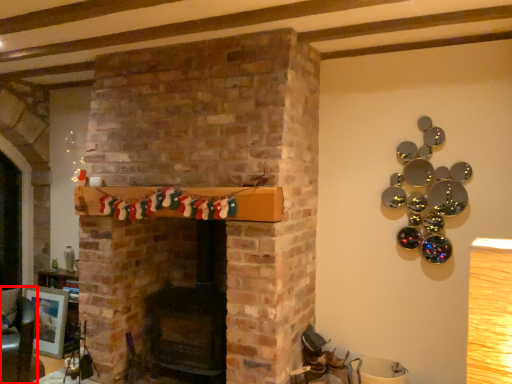
Question: From the image's perspective, where is armchair (annotated by the red box) located in relation to picture frame in the image?

Choices:
 (A) above
 (B) below

Answer: (A)